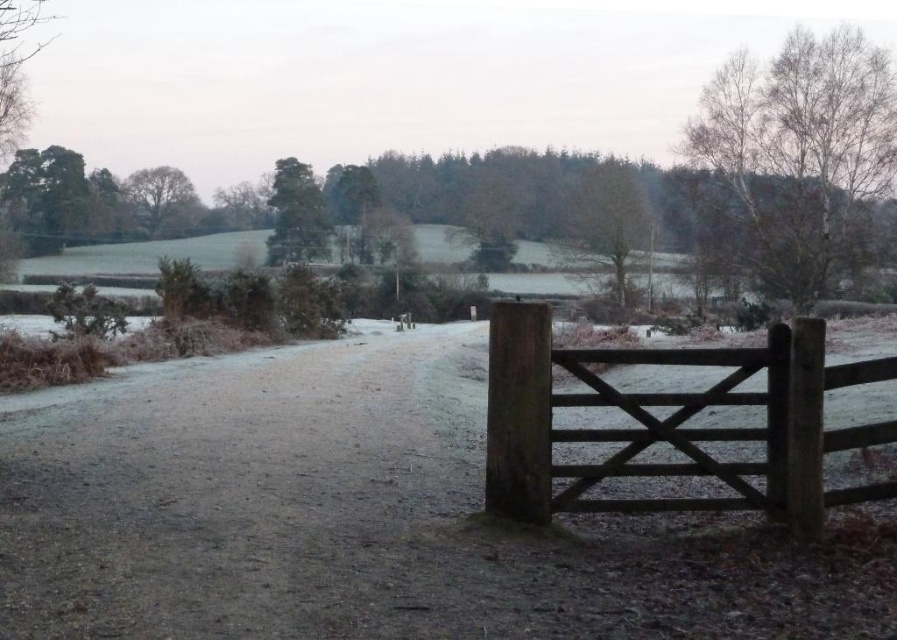
You are a photographer aiming to capture the height difference between the bare birch tree at upper right and the green leafy tree at upper left in your shot. Which tree should you focus on to emphasize its height in the composition?

The bare birch tree at upper right has a greater height compared to the green leafy tree at upper left, so focusing on it will better emphasize its height in the composition.